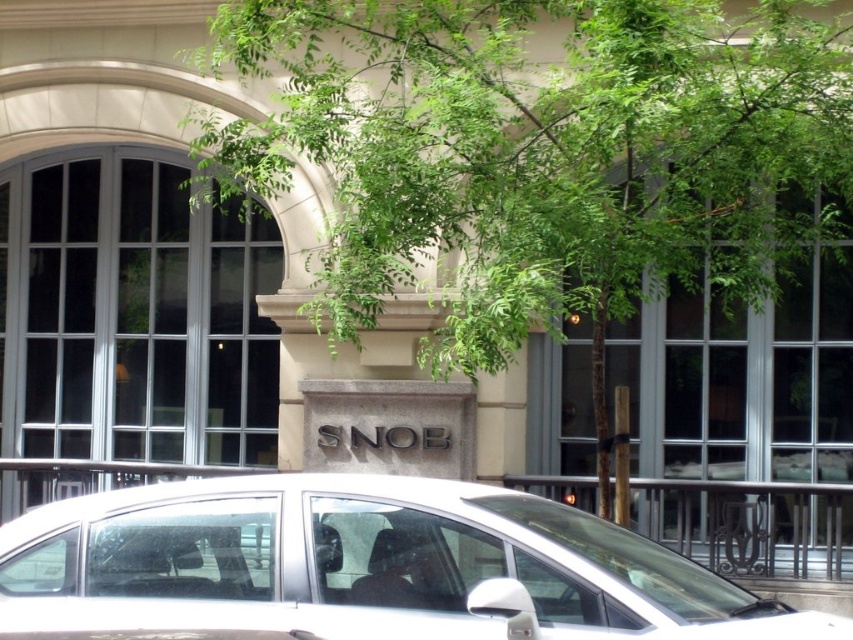
You are a delivery person who needs to park your vehicle in the parking lot behind the building. However, there is a green leafy tree at center and a white matte car at center in the way. Can you drive your car through the space between them?

The green leafy tree at center and white matte car at center are 6.75 feet apart from each other. Since the distance between them is sufficient for a standard vehicle to pass through, you can drive your car through the space between them.

You are a delivery person who needs to park your vehicle in front of the building. The parking spot is directly in front of the white matte car at center. There is a green leafy tree at center nearby. Will the tree block the view of the building entrance from your parked car?

The green leafy tree at center is taller than the white matte car at center. Since the tree is taller, it might block the view of the building entrance when parked in front of the white matte car at center.